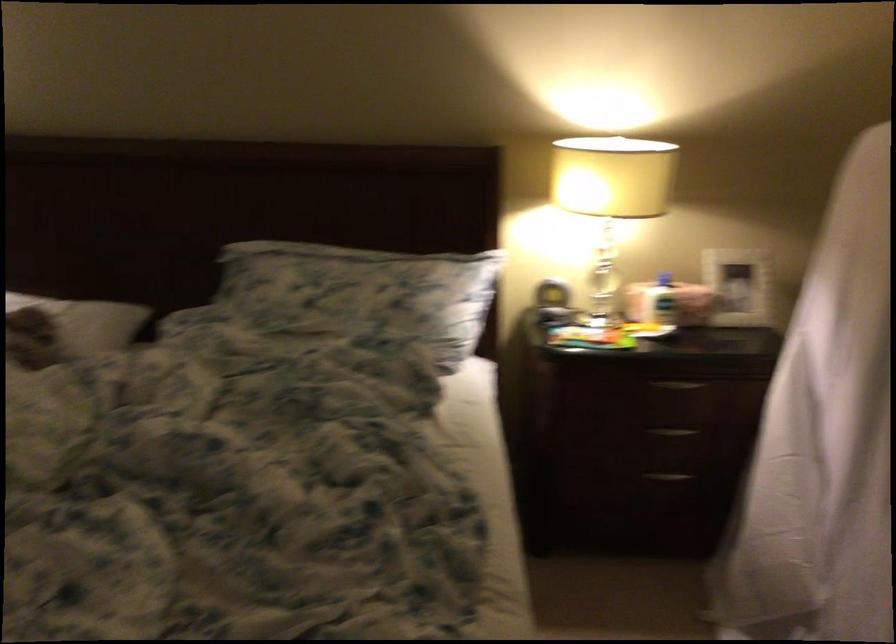
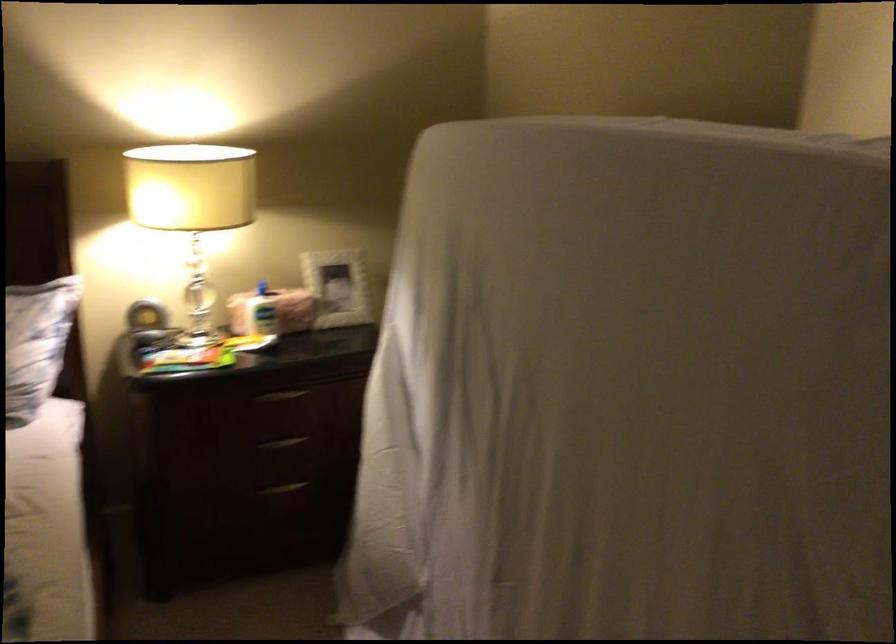
Where in the second image is the point corresponding to [670,274] from the first image?

(262, 288)